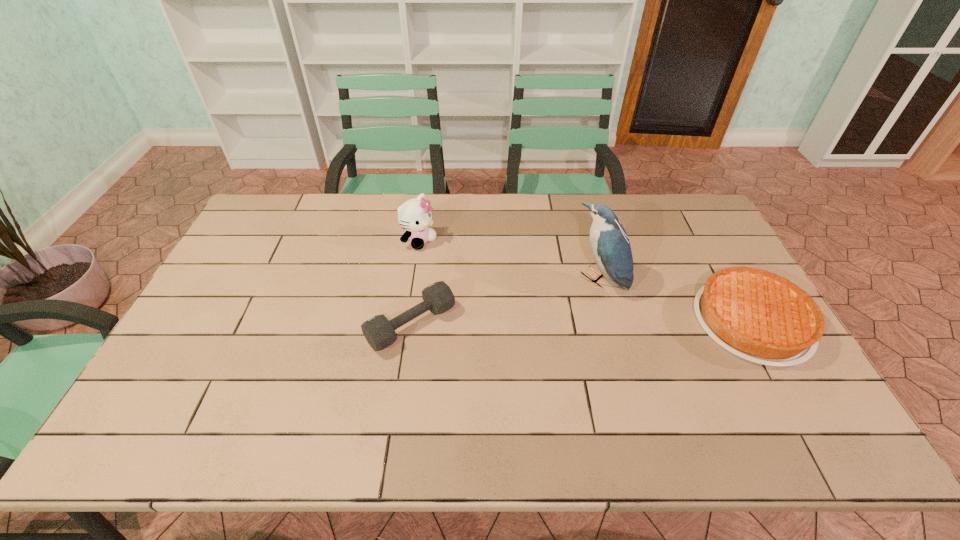
Find the location of `blank space located 0.370m at the tip of the bird's beak`. blank space located 0.370m at the tip of the bird's beak is located at coordinates (490, 359).

Find the location of a particular element. The image size is (960, 540). vacant space located on the front-facing side of the farthest object is located at coordinates (453, 261).

Find the location of a particular element. The width and height of the screenshot is (960, 540). vacant space located 0.220m on the front-facing side of the farthest object is located at coordinates (482, 279).

The width and height of the screenshot is (960, 540). Identify the location of free location located 0.050m on the front-facing side of the farthest object. (443, 254).

Where is `object situated at the far edge`? object situated at the far edge is located at coordinates (414, 215).

Find the location of a particular element. object located in the right edge section of the desktop is located at coordinates (761, 317).

Where is `vacant space at the far edge of the desktop`? The height and width of the screenshot is (540, 960). vacant space at the far edge of the desktop is located at coordinates (490, 200).

The width and height of the screenshot is (960, 540). Find the location of `vacant region at the near edge of the desktop`. vacant region at the near edge of the desktop is located at coordinates [301, 395].

The width and height of the screenshot is (960, 540). I want to click on free space at the left edge of the desktop, so click(x=213, y=295).

This screenshot has height=540, width=960. Find the location of `free region at the right edge`. free region at the right edge is located at coordinates (706, 246).